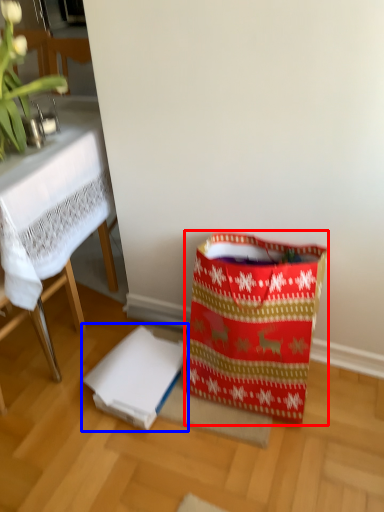
Question: Which object appears closest to the camera in this image, shopping bag (highlighted by a red box) or cardboard box (highlighted by a blue box)?

Choices:
 (A) shopping bag
 (B) cardboard box

Answer: (A)